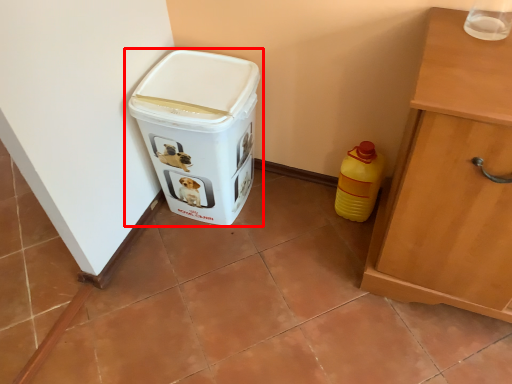
Question: Observing the image, what is the correct spatial positioning of waste container (annotated by the red box) in reference to bottle?

Choices:
 (A) right
 (B) left

Answer: (B)